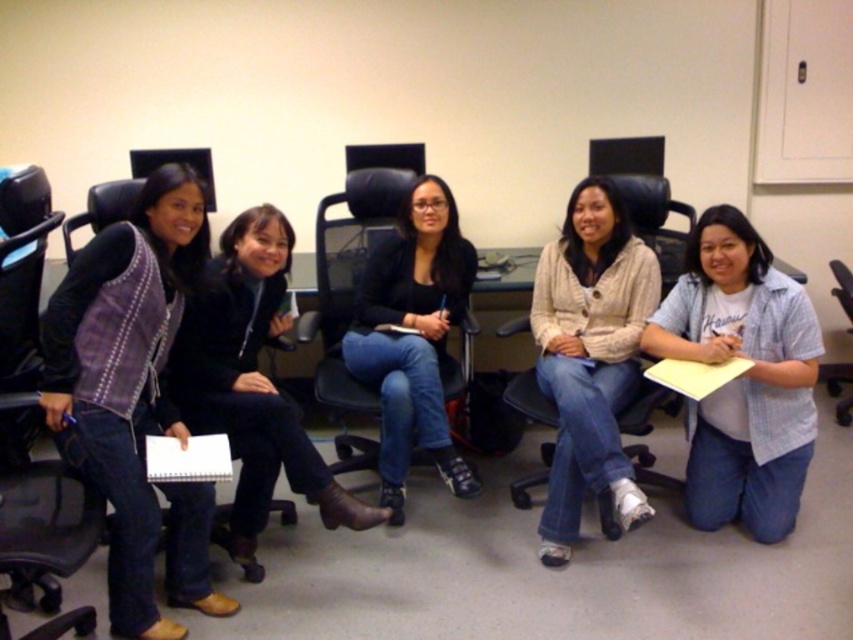
Question: Does plaid fabric vest at left appear under light blue plaid shirt at lower right?

Choices:
 (A) no
 (B) yes

Answer: (B)

Question: Does light beige sweater at center appear over black matte jacket at center?

Choices:
 (A) no
 (B) yes

Answer: (A)

Question: Considering the real-world distances, which object is closest to the black matte jacket at center?

Choices:
 (A) black leather swivel chair at left
 (B) black plastic swivel chair at lower right

Answer: (A)

Question: Which point is closer to the camera?

Choices:
 (A) black leather swivel chair at left
 (B) black leather boots at center

Answer: (A)

Question: Estimate the real-world distances between objects in this image. Which object is farther from the black leather swivel chair at left?

Choices:
 (A) plaid fabric vest at left
 (B) black leather boots at center

Answer: (B)

Question: Is the position of plaid fabric vest at left more distant than that of black leather boots at center?

Choices:
 (A) no
 (B) yes

Answer: (A)